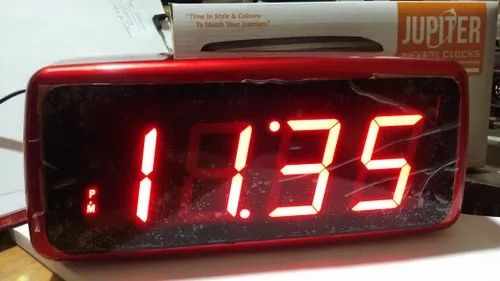
You are a GUI agent. You are given a task and a screenshot of the screen. Output one action in this format:
    pyautogui.click(x=<x>, y=<y>)
    Task: Click on the white paper on clipboard
    The image size is (500, 281).
    Given the screenshot: What is the action you would take?
    pyautogui.click(x=153, y=9)